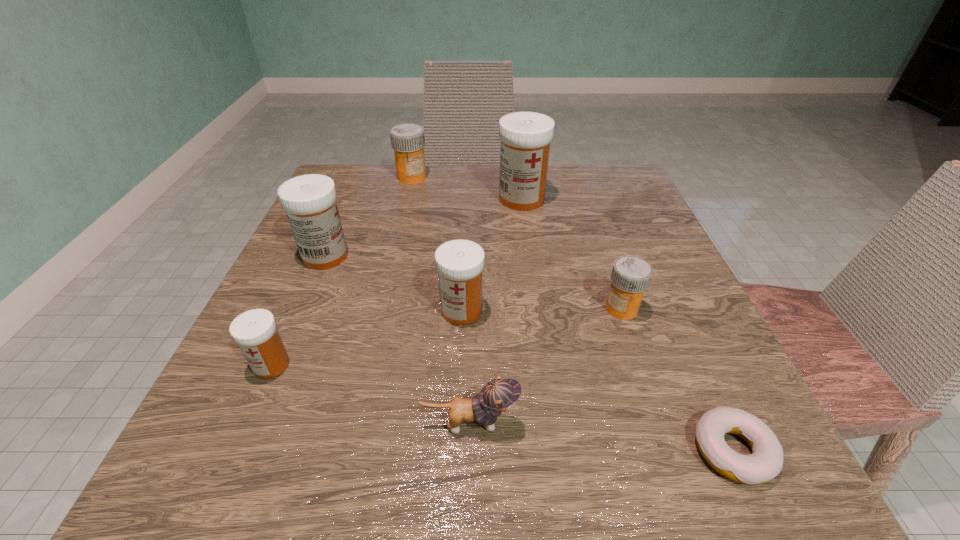
In order to click on vacant area that satisfies the following two spatial constraints: 1. on the front side of the brown doughnut; 2. on the left side of the rightmost white medicine in this screenshot , I will do `click(556, 451)`.

Identify the location of vacant space that satisfies the following two spatial constraints: 1. on the front side of the rightmost object; 2. on the left side of the third white medicine from left to right. The width and height of the screenshot is (960, 540). (456, 451).

This screenshot has height=540, width=960. Identify the location of vacant space that satisfies the following two spatial constraints: 1. on the label side of the tallest object; 2. on the right side of the farthest medicine. (407, 199).